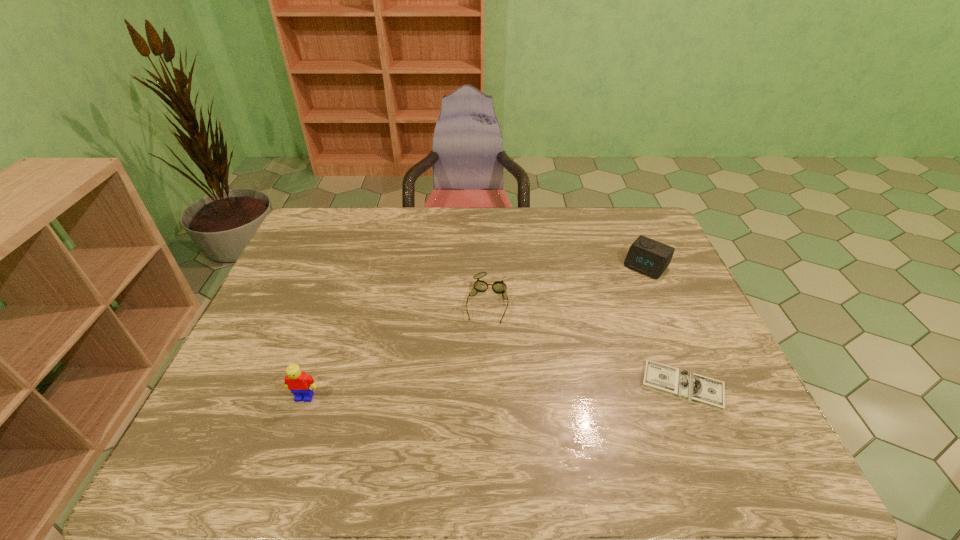
The image size is (960, 540). Find the location of `vacant space at the left edge of the desktop`. vacant space at the left edge of the desktop is located at coordinates (244, 354).

This screenshot has height=540, width=960. In order to click on vacant region at the right edge of the desktop in this screenshot , I will do `click(702, 323)`.

The image size is (960, 540). In the image, there is a desktop. Identify the location of blank space at the far right corner. (642, 233).

The image size is (960, 540). In order to click on free space that is in between the alarm clock and the leftmost object in this screenshot , I will do `click(475, 332)`.

Where is `vacant area that lies between the third object from right to left and the tallest object`? vacant area that lies between the third object from right to left and the tallest object is located at coordinates (396, 349).

Image resolution: width=960 pixels, height=540 pixels. Identify the location of vacant area between the second object from left to right and the shortest object. (585, 343).

Where is `vacant space in between the shortest object and the leftmost object`? vacant space in between the shortest object and the leftmost object is located at coordinates (493, 392).

Locate an element on the screen. The image size is (960, 540). vacant area that lies between the shortest object and the alarm clock is located at coordinates (664, 326).

This screenshot has height=540, width=960. In order to click on vacant area that lies between the second tallest object and the Lego in this screenshot , I will do `click(475, 332)`.

Find the location of `free point between the Lego and the second object from left to right`. free point between the Lego and the second object from left to right is located at coordinates (396, 349).